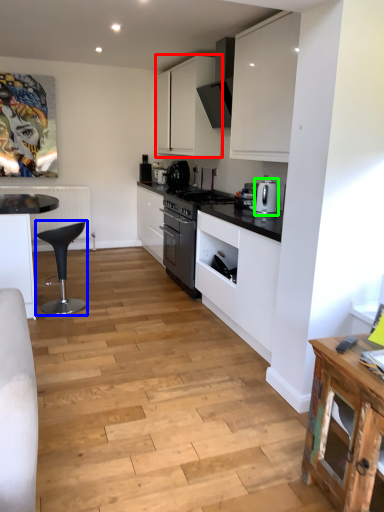
Question: Which object is positioned closest to cabinetry (highlighted by a red box)? Select from bar stool (highlighted by a blue box) and kitchen appliance (highlighted by a green box).

Choices:
 (A) bar stool
 (B) kitchen appliance

Answer: (B)